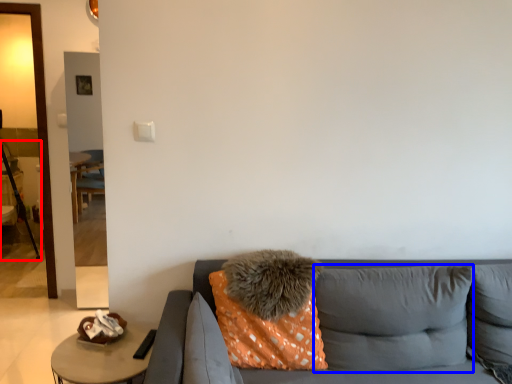
Question: Which point is further to the camera, tripod (highlighted by a red box) or pillow (highlighted by a blue box)?

Choices:
 (A) tripod
 (B) pillow

Answer: (A)